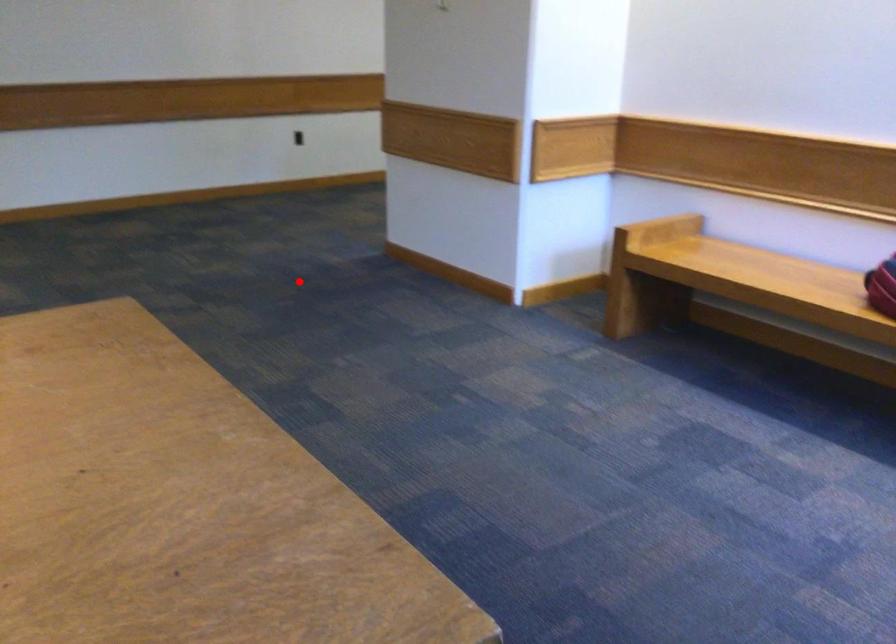
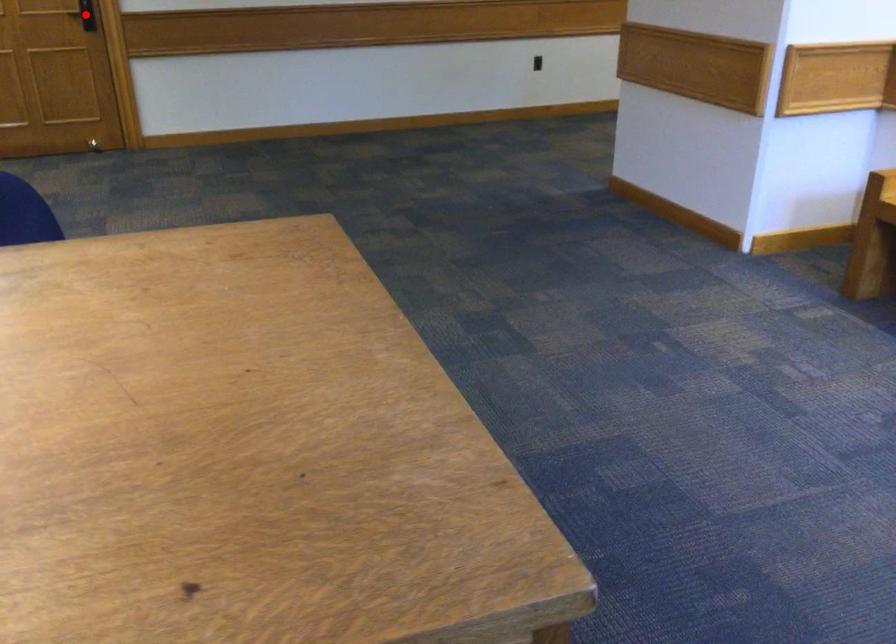
I am providing you with two images of the same scene from different viewpoints. A red point is marked on the first image and another point is marked on the second image. Is the marked point in image1 the same physical position as the marked point in image2?

No